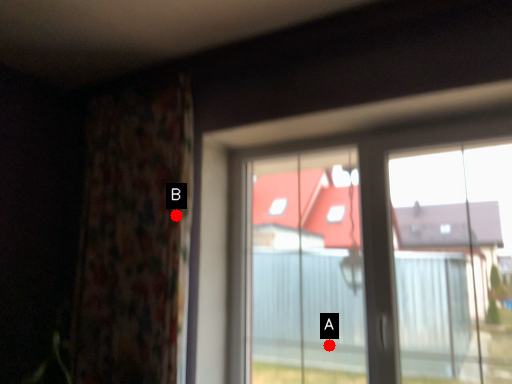
Question: Two points are circled on the image, labeled by A and B beside each circle. Which point is closer to the camera?

Choices:
 (A) A is closer
 (B) B is closer

Answer: (B)